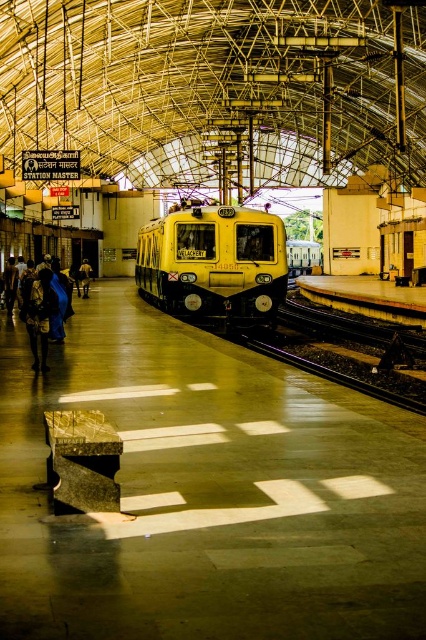
You are a maintenance worker at the station. You need to access the black metal train track at lower center to inspect it. However, there is a dark blue fabric at left covering part of the track. Can you reach the track without moving the fabric?

The black metal train track at lower center is positioned under the dark blue fabric at left, so part of the track is covered by the fabric. To inspect the entire track, you would need to move the fabric to access the covered section.

You are standing at the point labeled as point (213, 262) in the train station. What object are you closest to?

The point (213, 262) corresponds to the yellow matte train at center, so you are closest to the yellow matte train at center.